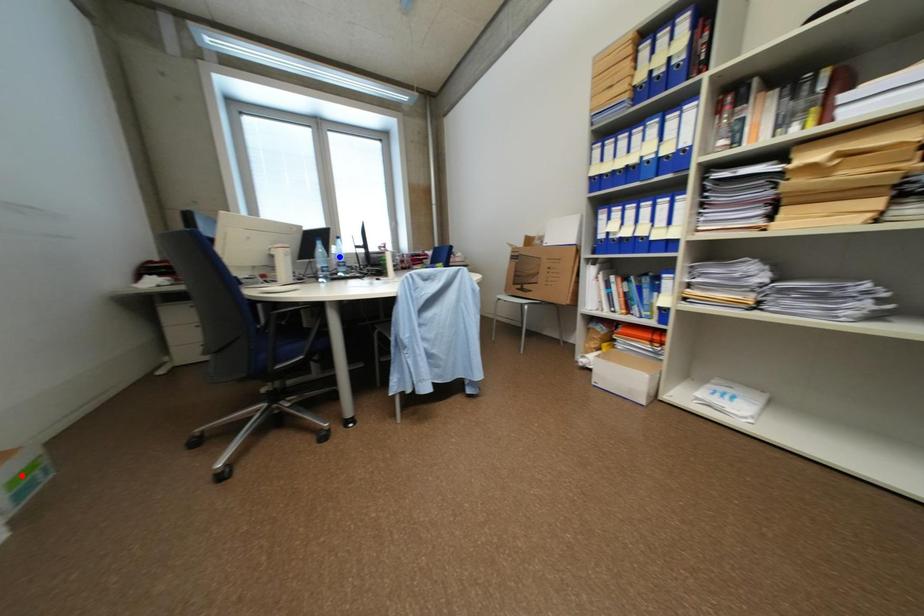
Question: In the image, two points are highlighted. Which point is nearer to the camera? Reply with the corresponding letter.

Choices:
 (A) blue point
 (B) red point

Answer: (B)